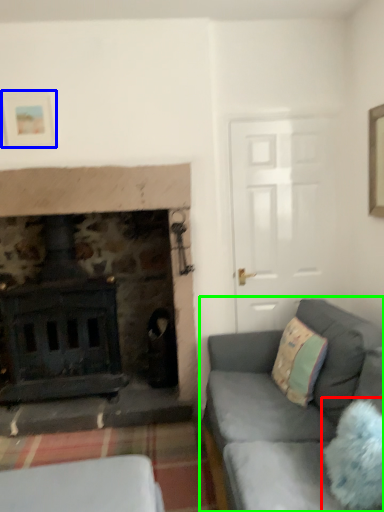
Question: Which object is the closest to the pillow (highlighted by a red box)? Choose among these: picture frame (highlighted by a blue box) or studio couch (highlighted by a green box).

Choices:
 (A) picture frame
 (B) studio couch

Answer: (B)